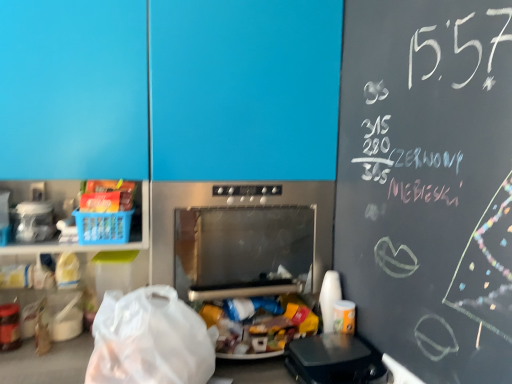
Question: Is black plastic waffle maker at lower right, the first appliance in the right-to-left sequence, at the right side of clear plastic container at left, placed as the first appliance when sorted from top to bottom?

Choices:
 (A) no
 (B) yes

Answer: (B)

Question: Is black plastic waffle maker at lower right, the first appliance in the right-to-left sequence, behind clear plastic container at left, placed as the first appliance when sorted from top to bottom?

Choices:
 (A) no
 (B) yes

Answer: (A)

Question: From the image's perspective, would you say black plastic waffle maker at lower right, the first appliance in the right-to-left sequence, is shown under clear plastic container at left, acting as the 1th appliance starting from the left?

Choices:
 (A) yes
 (B) no

Answer: (A)

Question: From a real-world perspective, is black plastic waffle maker at lower right, the first appliance in the right-to-left sequence, on clear plastic container at left, placed as the first appliance when sorted from top to bottom?

Choices:
 (A) no
 (B) yes

Answer: (A)

Question: Is clear plastic container at left, placed as the first appliance when sorted from top to bottom, surrounded by black plastic waffle maker at lower right, placed as the third appliance when sorted from left to right?

Choices:
 (A) no
 (B) yes

Answer: (A)

Question: Is black plastic waffle maker at lower right, which is the first appliance in bottom-to-top order, turned away from clear plastic container at left, the 3th appliance in the right-to-left sequence?

Choices:
 (A) yes
 (B) no

Answer: (B)

Question: Can you confirm if stainless steel microwave at center, arranged as the 2th appliance when viewed from the right, is thinner than transparent plastic grocery bag at lower left?

Choices:
 (A) yes
 (B) no

Answer: (B)

Question: Can you confirm if stainless steel microwave at center, positioned as the 2th appliance in top-to-bottom order, is shorter than transparent plastic grocery bag at lower left?

Choices:
 (A) no
 (B) yes

Answer: (A)

Question: Does stainless steel microwave at center, arranged as the 2th appliance when viewed from the right, come behind transparent plastic grocery bag at lower left?

Choices:
 (A) yes
 (B) no

Answer: (A)

Question: Does stainless steel microwave at center, positioned as the second appliance in bottom-to-top order, appear on the right side of transparent plastic grocery bag at lower left?

Choices:
 (A) no
 (B) yes

Answer: (B)

Question: Does stainless steel microwave at center, arranged as the 2th appliance when viewed from the right, appear on the left side of transparent plastic grocery bag at lower left?

Choices:
 (A) no
 (B) yes

Answer: (A)

Question: Can you confirm if stainless steel microwave at center, arranged as the 2th appliance when viewed from the right, is smaller than transparent plastic grocery bag at lower left?

Choices:
 (A) yes
 (B) no

Answer: (B)

Question: Considering the relative sizes of transparent plastic grocery bag at lower left and black plastic waffle maker at lower right, arranged as the 3th appliance when viewed from the top, in the image provided, is transparent plastic grocery bag at lower left bigger than black plastic waffle maker at lower right, arranged as the 3th appliance when viewed from the top,?

Choices:
 (A) no
 (B) yes

Answer: (B)